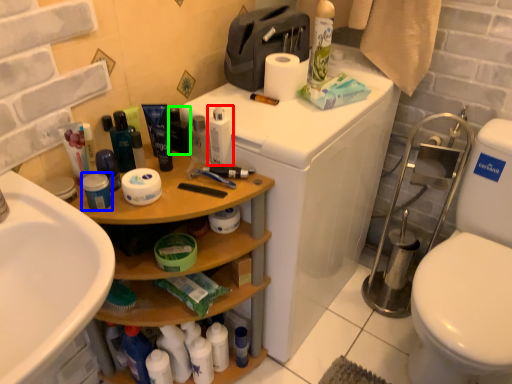
Question: Estimate the real-world distances between objects in this image. Which object is closer to toiletry (highlighted by a red box), toiletry (highlighted by a blue box) or toiletry (highlighted by a green box)?

Choices:
 (A) toiletry
 (B) toiletry

Answer: (B)